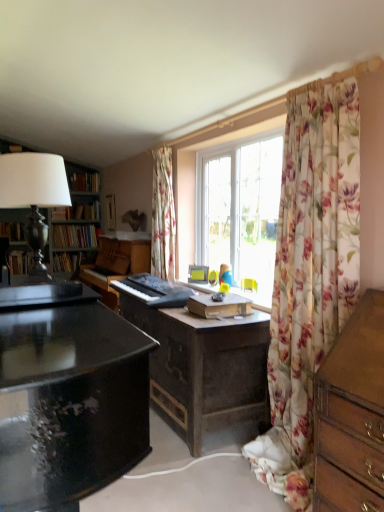
Question: Should I look upward or downward to see hardcover book at left, the third book positioned from the top?

Choices:
 (A) down
 (B) up

Answer: (B)

Question: Is floral fabric curtain at center, arranged as the 2th curtain when viewed from the front, at the right side of black matte keyboard at center?

Choices:
 (A) no
 (B) yes

Answer: (B)

Question: Does floral fabric curtain at center, which appears as the 2th curtain when viewed from the right, turn towards black matte keyboard at center?

Choices:
 (A) yes
 (B) no

Answer: (B)

Question: Is floral fabric curtain at center, which is the 1th curtain in back-to-front order, next to black matte keyboard at center and touching it?

Choices:
 (A) yes
 (B) no

Answer: (B)

Question: From the image's perspective, would you say floral fabric curtain at center, arranged as the 1th curtain when viewed from the left, is positioned over black matte keyboard at center?

Choices:
 (A) no
 (B) yes

Answer: (B)

Question: Considering the relative positions of floral fabric curtain at center, which is the 1th curtain in back-to-front order, and black matte keyboard at center in the image provided, is floral fabric curtain at center, which is the 1th curtain in back-to-front order, to the left of black matte keyboard at center from the viewer's perspective?

Choices:
 (A) yes
 (B) no

Answer: (B)

Question: Is floral fabric curtain at center, which appears as the 2th curtain when viewed from the right, positioned before black matte keyboard at center?

Choices:
 (A) yes
 (B) no

Answer: (B)

Question: From a real-world perspective, is floral sheer curtain at right, the 1th curtain viewed from the front, located beneath hardcover book at left, acting as the second book starting from the top?

Choices:
 (A) no
 (B) yes

Answer: (B)

Question: Is floral sheer curtain at right, the 1th curtain viewed from the front, bigger than hardcover book at left, acting as the second book starting from the top?

Choices:
 (A) no
 (B) yes

Answer: (B)

Question: Does floral sheer curtain at right, placed as the 1th curtain when sorted from right to left, have a greater width compared to hardcover book at left, arranged as the 3th book when ordered from the bottom?

Choices:
 (A) no
 (B) yes

Answer: (B)

Question: Does floral sheer curtain at right, placed as the 1th curtain when sorted from right to left, come in front of hardcover book at left, acting as the second book starting from the top?

Choices:
 (A) yes
 (B) no

Answer: (A)

Question: From a real-world perspective, is floral sheer curtain at right, placed as the 1th curtain when sorted from right to left, on hardcover book at left, acting as the second book starting from the top?

Choices:
 (A) yes
 (B) no

Answer: (B)

Question: Is floral sheer curtain at right, which appears as the second curtain when viewed from the left, to the right of hardcover book at left, acting as the second book starting from the top, from the viewer's perspective?

Choices:
 (A) no
 (B) yes

Answer: (B)

Question: Is matte yellow picture frame at center, placed as the second picture frame when sorted from top to bottom, positioned behind hardcover book at left, arranged as the 3th book when ordered from the bottom?

Choices:
 (A) yes
 (B) no

Answer: (B)